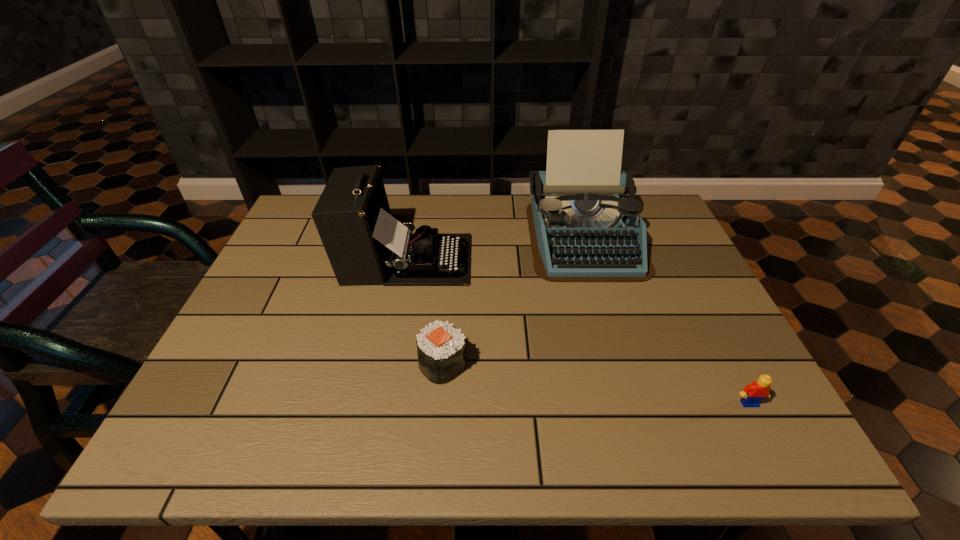
The height and width of the screenshot is (540, 960). I want to click on unoccupied area between the rightmost object and the left typewriter, so click(578, 332).

At what (x,y) coordinates should I click in order to perform the action: click on free space between the rightmost object and the right typewriter. Please return your answer as a coordinate pair (x, y). Image resolution: width=960 pixels, height=540 pixels. Looking at the image, I should click on (666, 320).

Locate an element on the screen. empty location between the left typewriter and the third farthest object is located at coordinates (425, 312).

Where is `empty space between the sushi and the Lego`? Image resolution: width=960 pixels, height=540 pixels. empty space between the sushi and the Lego is located at coordinates (596, 384).

Find the location of a particular element. free space between the right typewriter and the left typewriter is located at coordinates (495, 248).

What are the coordinates of `free space between the left typewriter and the rightmost object` in the screenshot? It's located at (578, 332).

Where is `empty space that is in between the second nearest object and the right typewriter`? The height and width of the screenshot is (540, 960). empty space that is in between the second nearest object and the right typewriter is located at coordinates (514, 301).

Locate which object is the third closest to the rightmost object. Please provide its 2D coordinates. Your answer should be formatted as a tuple, i.e. [(x, y)], where the tuple contains the x and y coordinates of a point satisfying the conditions above.

[(365, 244)]

Choose which object is the third nearest neighbor to the third farthest object. Please provide its 2D coordinates. Your answer should be formatted as a tuple, i.e. [(x, y)], where the tuple contains the x and y coordinates of a point satisfying the conditions above.

[(752, 394)]

The height and width of the screenshot is (540, 960). I want to click on free space in the image that satisfies the following two spatial constraints: 1. on the typing side of the right typewriter; 2. inside the open case of the left typewriter, so click(x=589, y=259).